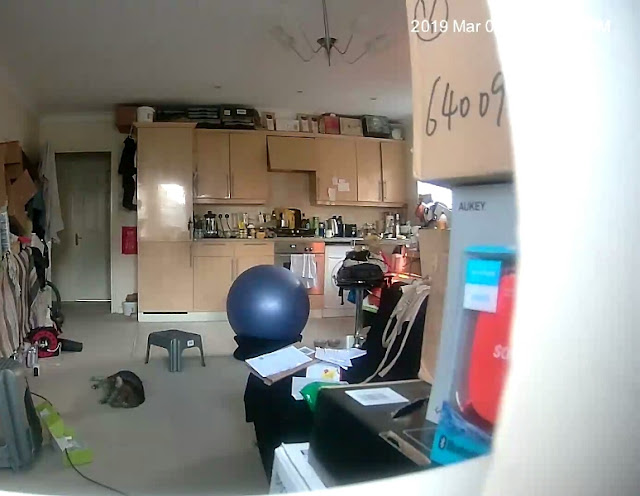
Find the location of `large cardboard box`. large cardboard box is located at coordinates (461, 55).